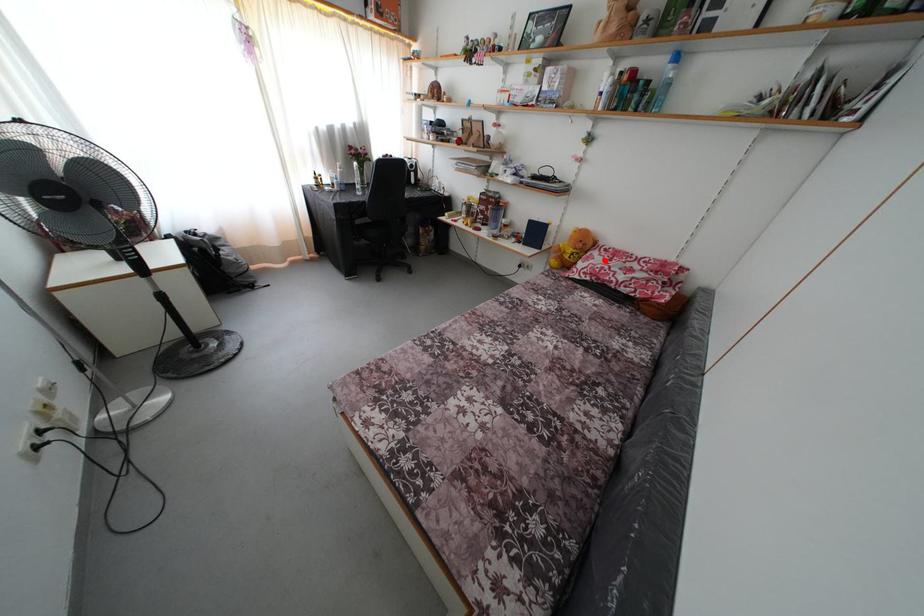
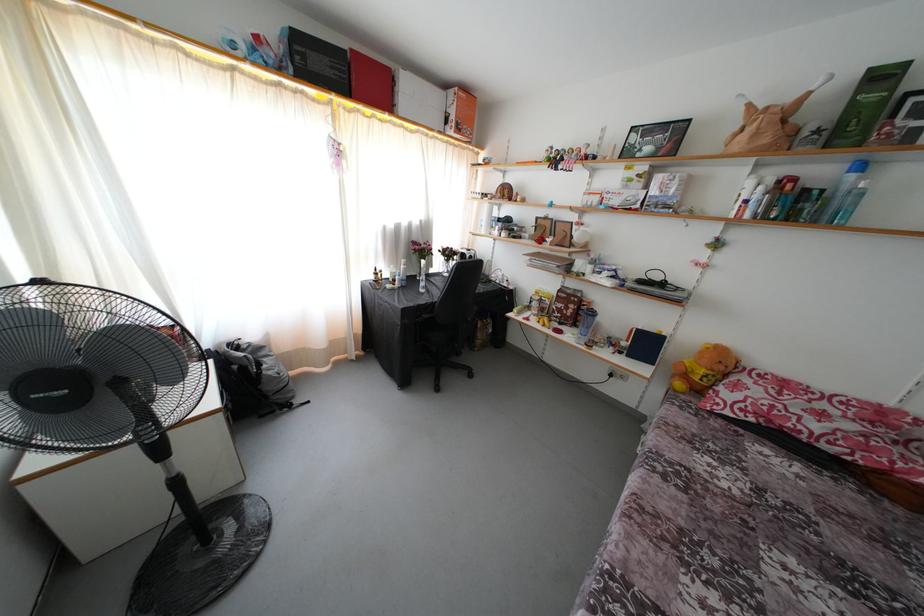
Question: I am providing you with two images of the same scene from different viewpoints. Given a red point in image1, look at the same physical point in image2. Is it:

Choices:
 (A) Closer to the viewpoint
 (B) Farther from the viewpoint

Answer: (B)